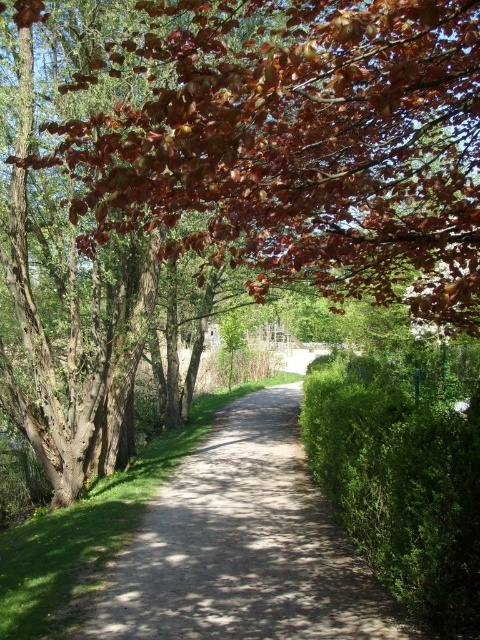
You are standing at the start of the pathway and want to take a photo that includes both the brown leafy tree at upper left and the green leafy hedge at right. Which object should appear closer to the camera in your photo?

The brown leafy tree at upper left should appear closer to the camera because it is in front of the green leafy hedge at right.

You are standing at the entrance of the pathway and want to locate the brown leafy tree at upper left. According to the coordinates provided, where should you look relative to your current position?

The brown leafy tree at upper left is located at coordinates point (302,147). Since the coordinate system typically has the origin at the bottom left corner of the image, the x value of 0.231 places it slightly to the right of the left edge, and the y value of 0.631 places it about two thirds of the way up from the bottom. Therefore, you should look to the upper left direction from your current position at the entrance.